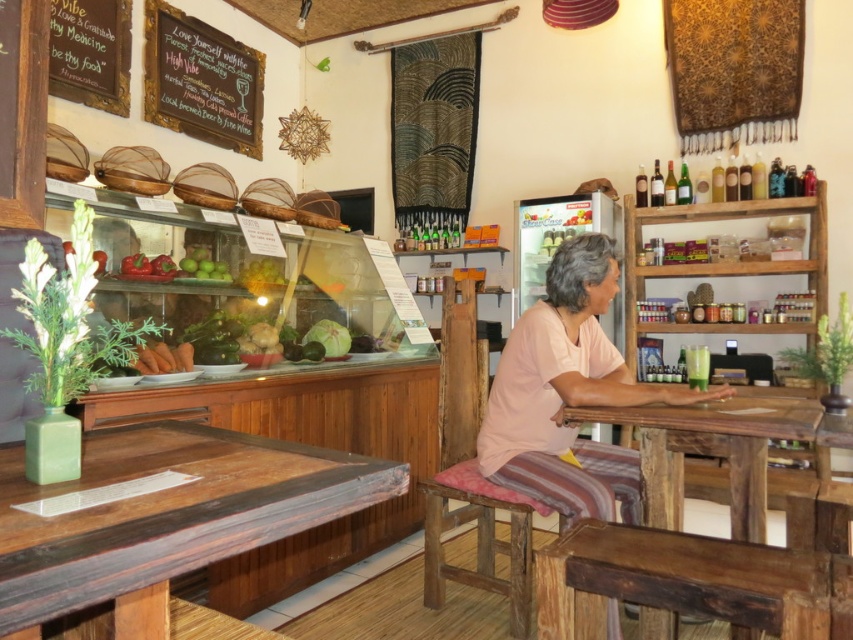
Who is positioned more to the right, dark brown wood table at center or rustic wood stool at center?

From the viewer's perspective, dark brown wood table at center appears more on the right side.

Where is `dark brown wood table at center`? Image resolution: width=853 pixels, height=640 pixels. dark brown wood table at center is located at coordinates (715, 449).

Which is behind, point (718, 406) or point (511, 592)?

The point (511, 592) is behind.

Locate an element on the screen. The height and width of the screenshot is (640, 853). dark brown wood table at center is located at coordinates (715, 449).

Does wooden table at lower left have a larger size compared to chalkboard sign at upper left?

Indeed, wooden table at lower left has a larger size compared to chalkboard sign at upper left.

Is the position of wooden table at lower left less distant than that of chalkboard sign at upper left?

Yes, wooden table at lower left is closer to the viewer.

Which is in front, point (289, 531) or point (120, 97)?

Point (289, 531)

You are a GUI agent. You are given a task and a screenshot of the screen. Output one action in this format:
    pyautogui.click(x=<x>, y=<y>)
    Task: Click on the wooden table at lower left
    This screenshot has height=640, width=853.
    Given the screenshot: What is the action you would take?
    pyautogui.click(x=165, y=518)

Who is shorter, wooden table at lower left or wooden chalkboard at upper left?

Standing shorter between the two is wooden table at lower left.

Is point (202, 508) behind point (212, 124)?

No, (202, 508) is closer to viewer.

Image resolution: width=853 pixels, height=640 pixels. I want to click on wooden table at lower left, so click(x=165, y=518).

The height and width of the screenshot is (640, 853). What are the coordinates of `wooden table at lower left` in the screenshot? It's located at [165, 518].